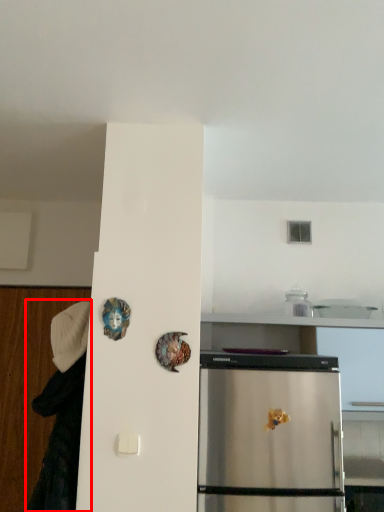
Question: In this image, where is couple (annotated by the red box) located relative to art?

Choices:
 (A) right
 (B) left

Answer: (B)